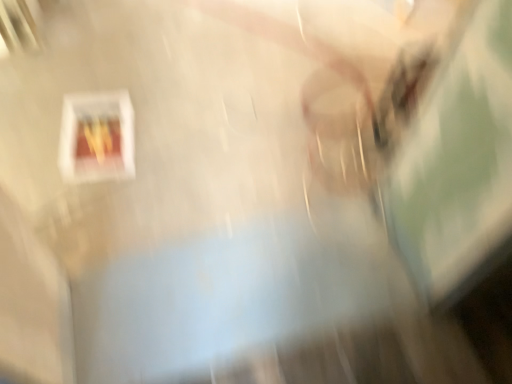
I want to click on free space behind matte wooden picture frame at lower left, so click(x=121, y=89).